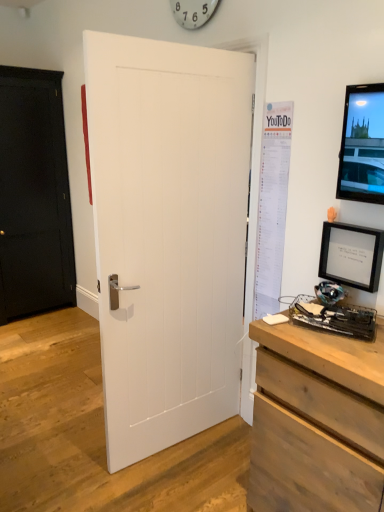
The width and height of the screenshot is (384, 512). Find the location of `vacant space in front of metallic black desktop computer at lower right`. vacant space in front of metallic black desktop computer at lower right is located at coordinates (349, 351).